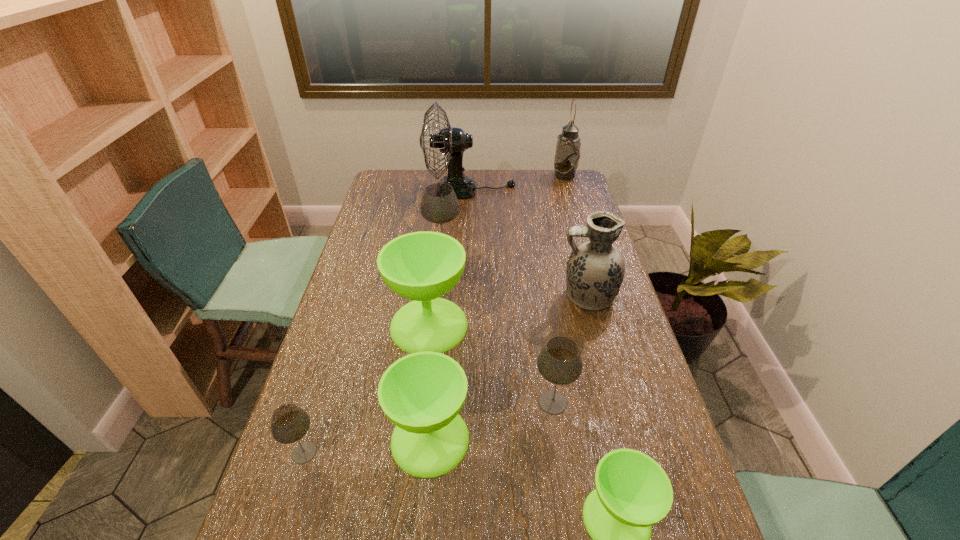
Where is `fan`? fan is located at coordinates (452, 141).

Where is `oil lamp`? This screenshot has width=960, height=540. oil lamp is located at coordinates (567, 155).

The height and width of the screenshot is (540, 960). I want to click on vase, so click(x=595, y=270).

I want to click on the farthest gray wineglass, so click(439, 204).

You are a GUI agent. You are given a task and a screenshot of the screen. Output one action in this format:
    pyautogui.click(x=<x>, y=<y>)
    Task: Click on the farthest wineglass
    The image size is (960, 540).
    Given the screenshot: What is the action you would take?
    pyautogui.click(x=439, y=204)

Where is `the farthest green wineglass`? Image resolution: width=960 pixels, height=540 pixels. the farthest green wineglass is located at coordinates (422, 266).

Identify the location of the fifth nearest wineglass. The height and width of the screenshot is (540, 960). (422, 266).

The width and height of the screenshot is (960, 540). Identify the location of the rightmost gray wineglass. (559, 362).

Where is `the second smallest gray wineglass`? The width and height of the screenshot is (960, 540). the second smallest gray wineglass is located at coordinates (559, 362).

Image resolution: width=960 pixels, height=540 pixels. Identify the location of the second biggest green wineglass. (422, 393).